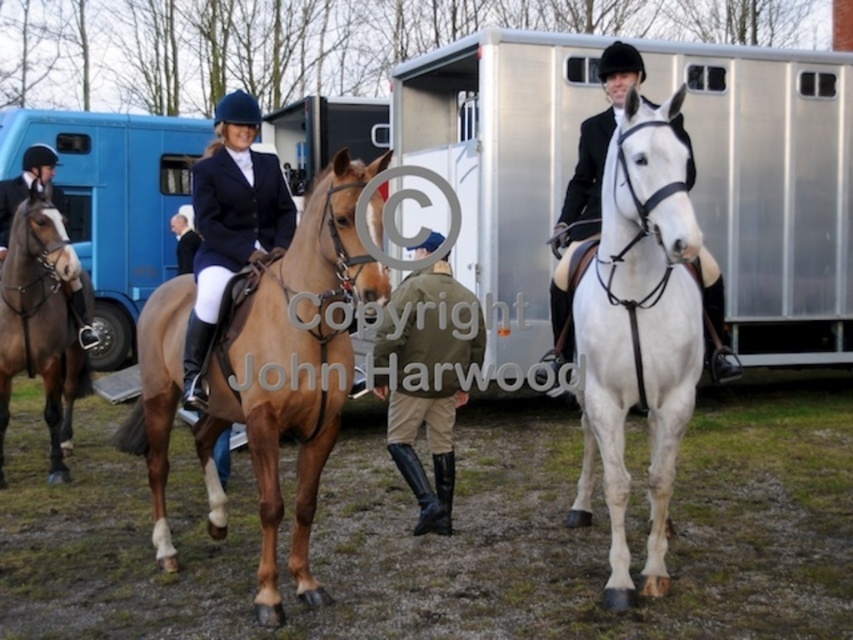
You are a photographer trying to capture a closeup of the navy blue fabric jacket at center and the white glossy horse at center. Which one is positioned lower in the image?

The navy blue fabric jacket at center is below the white glossy horse at center, so the navy blue fabric jacket at center is positioned lower in the image.

You are a photographer at the horse event. You want to take a photo that includes both the navy blue fabric jacket at center and the white glossy horse at center. Which object should you focus on first if you want the larger object to be in sharp focus?

The white glossy horse at center is larger than the navy blue fabric jacket at center. To ensure the larger object is in sharp focus, you should focus on the white glossy horse at center first.

You are a photographer at the horse event. You want to take a photo of the khaki fabric jacket at center and the white glossy horse at center. Based on their positions, which one will appear closer to the bottom of the photo?

The khaki fabric jacket at center is located below the white glossy horse at center, so it will appear closer to the bottom of the photo.